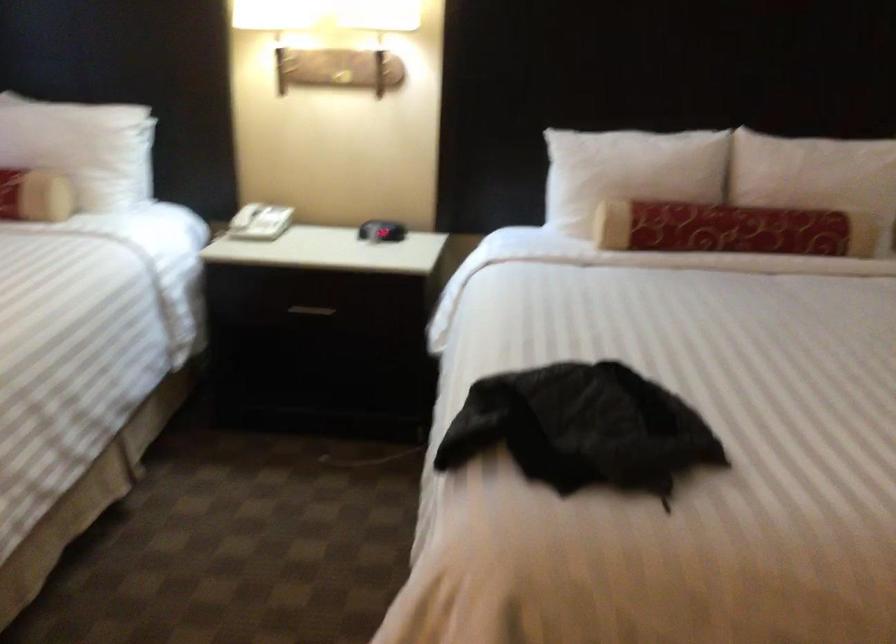
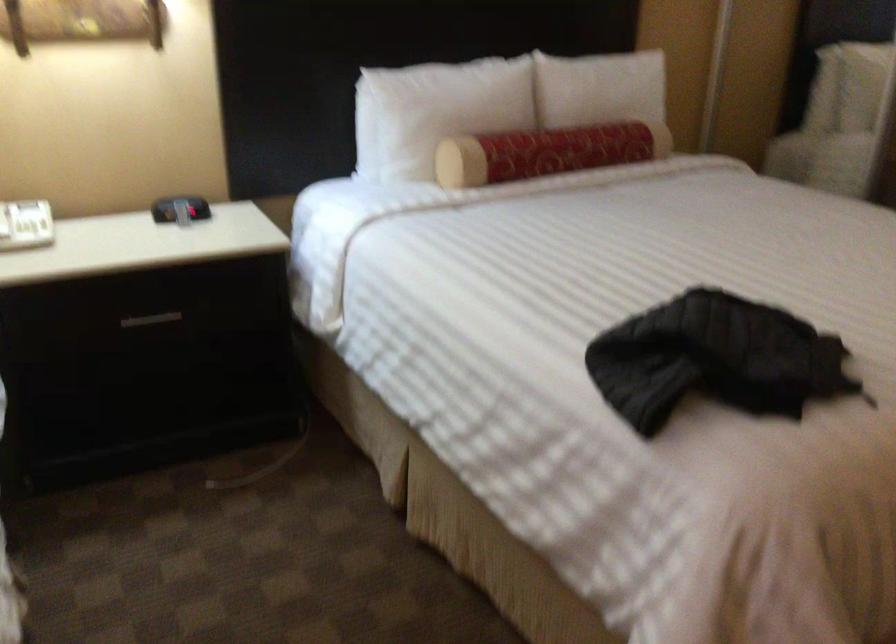
The point at (702, 223) is marked in the first image. Where is the corresponding point in the second image?

(546, 152)